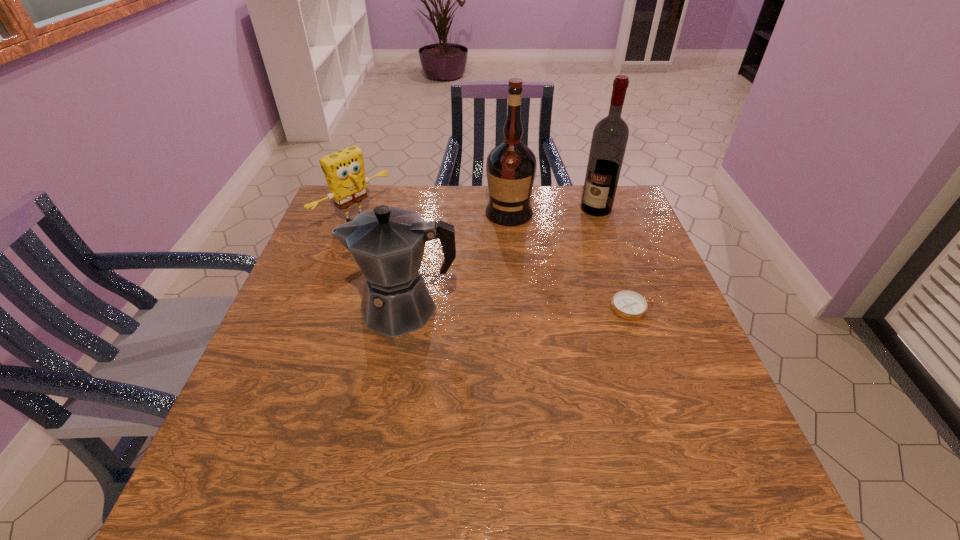
Identify which object is the closest to the alcohol. Please provide its 2D coordinates. Your answer should be formatted as a tuple, i.e. [(x, y)], where the tuple contains the x and y coordinates of a point satisfying the conditions above.

[(511, 166)]